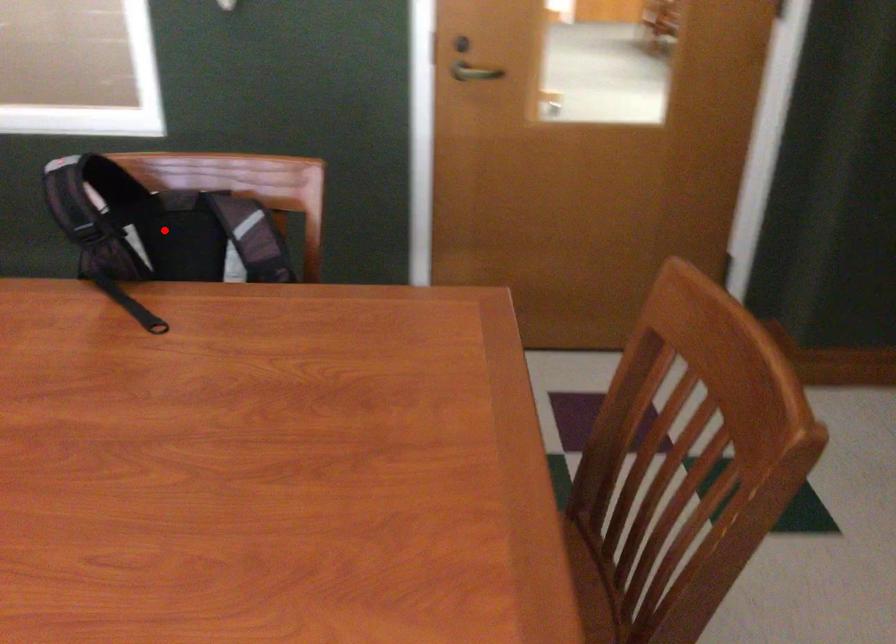
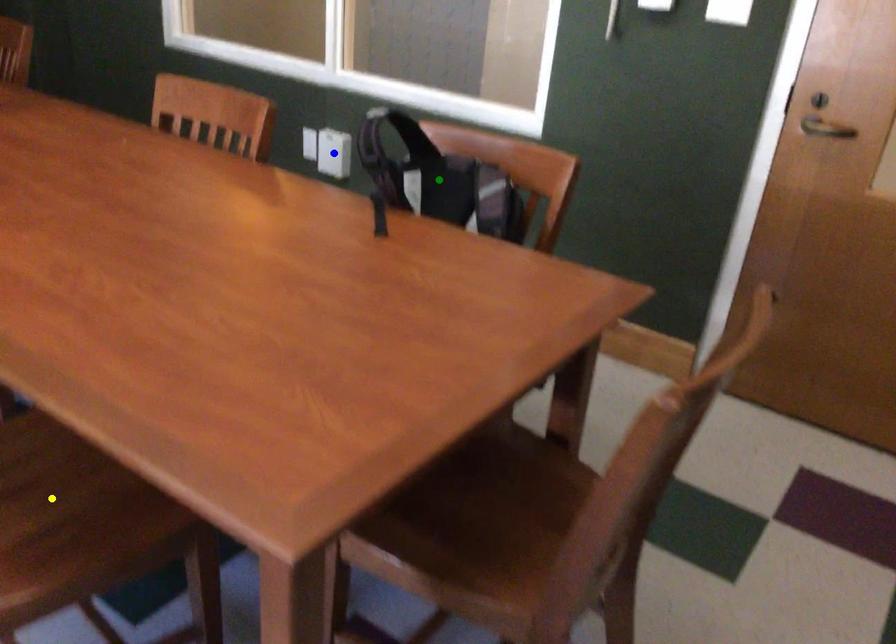
Question: I am providing you with two images of the same scene from different viewpoints. A red point is marked on the first image. You are given multiple points on the second image. Which spot in image 2 lines up with the point in image 1?

Choices:
 (A) green point
 (B) yellow point
 (C) blue point

Answer: (A)